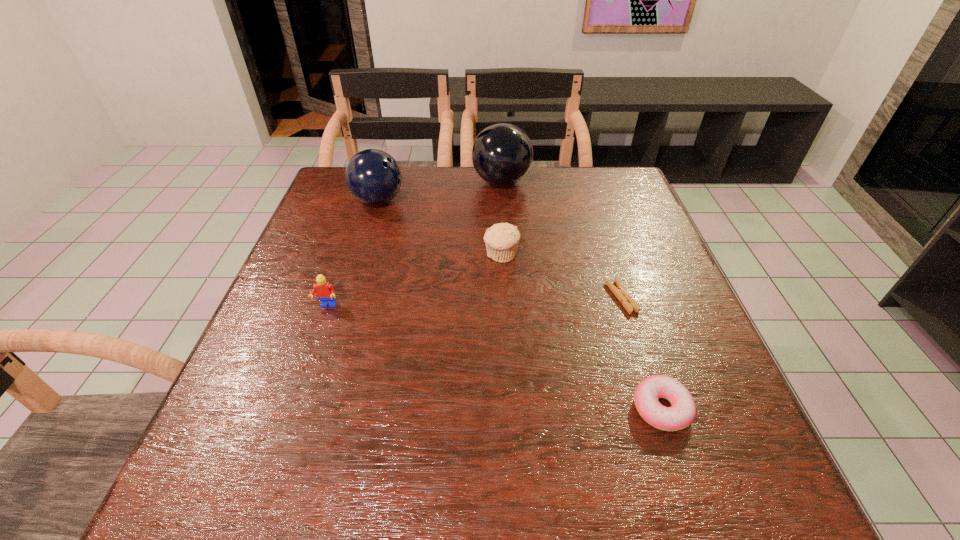
The height and width of the screenshot is (540, 960). In order to click on free space located on the side of the right bowling ball with the finger holes in this screenshot , I will do `click(425, 182)`.

This screenshot has width=960, height=540. I want to click on free location located on the surface of the fifth shortest object near the finger holes, so click(511, 201).

This screenshot has height=540, width=960. Identify the location of free space located 0.230m on the back of the muffin. (497, 194).

This screenshot has height=540, width=960. What are the coordinates of `vacant space located on the front-facing side of the Lego` in the screenshot? It's located at (308, 361).

Identify the location of free space located on the back of the doughnut. The height and width of the screenshot is (540, 960). (607, 245).

The height and width of the screenshot is (540, 960). I want to click on free space located 0.090m on the left of the clothespin, so click(x=567, y=298).

At what (x,y) coordinates should I click in order to perform the action: click on bowling ball that is positioned at the left edge. Please return your answer as a coordinate pair (x, y). The height and width of the screenshot is (540, 960). Looking at the image, I should click on (372, 176).

Locate an element on the screen. Lego present at the left edge is located at coordinates (324, 290).

Where is `doughnut that is at the right edge`? doughnut that is at the right edge is located at coordinates (681, 414).

Where is `clothespin that is at the right edge`? clothespin that is at the right edge is located at coordinates (620, 292).